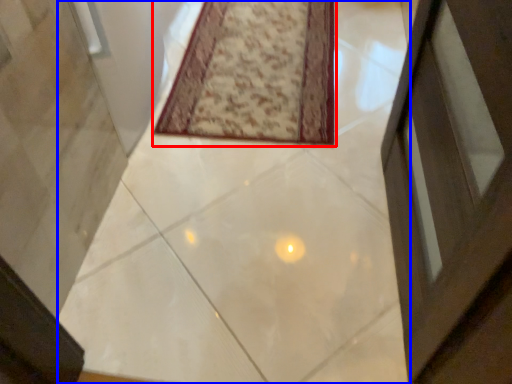
Question: Which point is further to the camera, mat (highlighted by a red box) or concrete (highlighted by a blue box)?

Choices:
 (A) mat
 (B) concrete

Answer: (A)